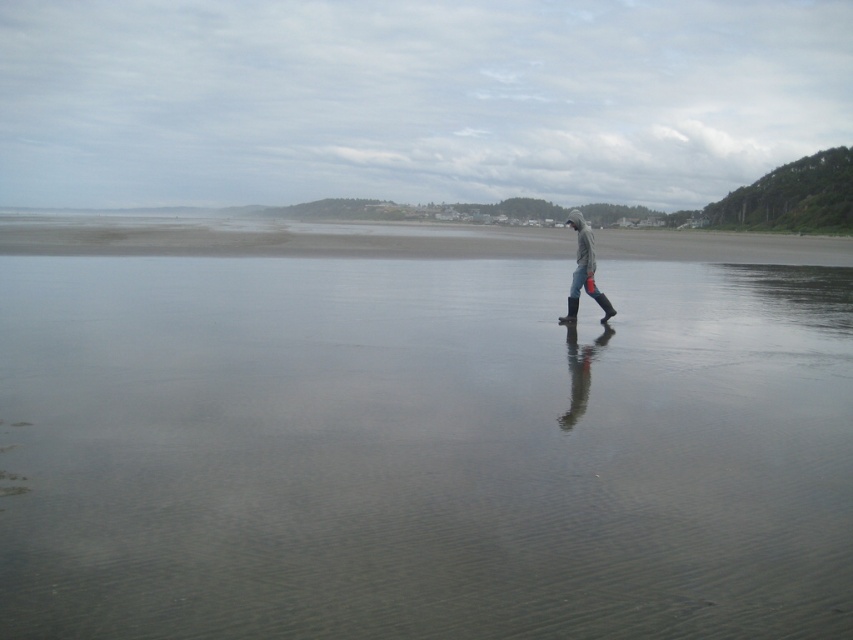
Looking at this image, who is positioned more to the left, clear water at center or gray rubber boots at center?

Positioned to the left is clear water at center.

Does clear water at center have a smaller size compared to gray rubber boots at center?

No.

Between point (57, 484) and point (607, 316), which one is positioned in front?

Point (57, 484) is in front.

You are a GUI agent. You are given a task and a screenshot of the screen. Output one action in this format:
    pyautogui.click(x=<x>, y=<y>)
    Task: Click on the clear water at center
    This screenshot has width=853, height=640.
    Given the screenshot: What is the action you would take?
    pyautogui.click(x=421, y=433)

Does point (619, 230) come in front of point (608, 316)?

No, it is not.

The height and width of the screenshot is (640, 853). I want to click on smooth sand beach at center, so click(x=271, y=237).

Which is below, clear water at center or smooth sand beach at center?

clear water at center is below.

Does point (846, 472) lie in front of point (660, 228)?

That is True.

Is point (851, 600) positioned before point (500, 250)?

That is True.

Where is `clear water at center`? clear water at center is located at coordinates (421, 433).